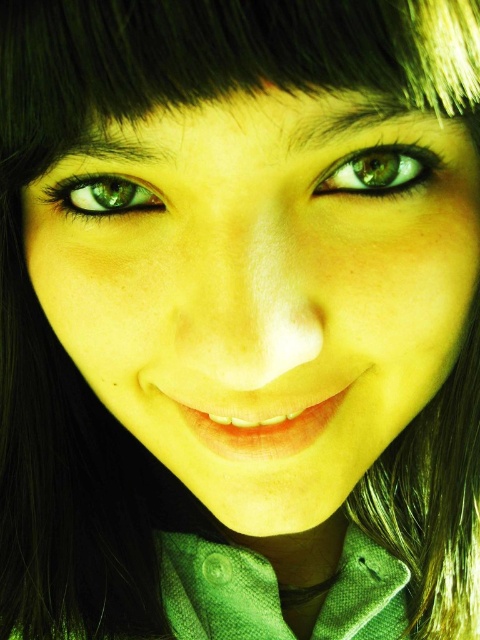
You are a makeup artist measuring facial features for a client. You need to ensure proper application around the eyes. Given the distance between the green matte face at center and the green matte eye at upper center, is this within the standard 3.5 inch guideline for average eye placement on a face?

The distance between the green matte face at center and the green matte eye at upper center is 3.32 inches, which is within the standard 3.5 inch guideline for average eye placement on a face.

Where is the green textured dress shirt at center located in the image?

The green textured dress shirt at center is located at position point (218, 589) in the image.

You are an artist trying to sketch the portrait shown. You need to determine the order of the points to draw them correctly based on their depth. Which point should you draw first, point (273, 634) or point (127, 179)?

You should draw point (127, 179) first because it is in front of point (273, 634), which is behind it.